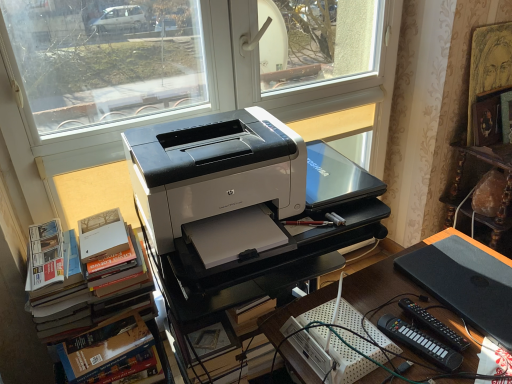
Question: Are white glossy printer at center and black matte laptop at lower right located far from each other?

Choices:
 (A) yes
 (B) no

Answer: (B)

Question: Is black matte laptop at lower right at the back of white glossy printer at center?

Choices:
 (A) no
 (B) yes

Answer: (A)

Question: Is white glossy printer at center bigger than black matte laptop at lower right?

Choices:
 (A) no
 (B) yes

Answer: (B)

Question: Is white glossy printer at center thinner than black matte laptop at lower right?

Choices:
 (A) yes
 (B) no

Answer: (B)

Question: Does white glossy printer at center have a smaller size compared to black matte laptop at lower right?

Choices:
 (A) no
 (B) yes

Answer: (A)

Question: Is point (203, 115) positioned closer to the camera than point (271, 264)?

Choices:
 (A) closer
 (B) farther

Answer: (B)

Question: From a real-world perspective, relative to white glossy printer at center, is white plastic printer at center vertically above or below?

Choices:
 (A) below
 (B) above

Answer: (B)

Question: Do you think white plastic printer at center is within white glossy printer at center, or outside of it?

Choices:
 (A) inside
 (B) outside

Answer: (B)

Question: Is white plastic printer at center in front of or behind white glossy printer at center in the image?

Choices:
 (A) behind
 (B) front

Answer: (B)

Question: Relative to black matte laptop at lower right, is black plastic remote control at lower right, acting as the 1th equipment starting from the left, in front or behind?

Choices:
 (A) behind
 (B) front

Answer: (B)

Question: Is black plastic remote control at lower right, positioned as the second equipment in right-to-left order, inside the boundaries of black matte laptop at lower right, or outside?

Choices:
 (A) inside
 (B) outside

Answer: (B)

Question: Is black plastic remote control at lower right, positioned as the second equipment in right-to-left order, taller or shorter than black matte laptop at lower right?

Choices:
 (A) short
 (B) tall

Answer: (B)

Question: From a real-world perspective, is black plastic remote control at lower right, acting as the 1th equipment starting from the left, above or below black matte laptop at lower right?

Choices:
 (A) above
 (B) below

Answer: (B)

Question: From a real-world perspective, relative to white plastic printer at center, is black plastic desk at center vertically above or below?

Choices:
 (A) below
 (B) above

Answer: (A)

Question: Looking at the image, does black plastic desk at center seem bigger or smaller compared to white plastic printer at center?

Choices:
 (A) big
 (B) small

Answer: (A)